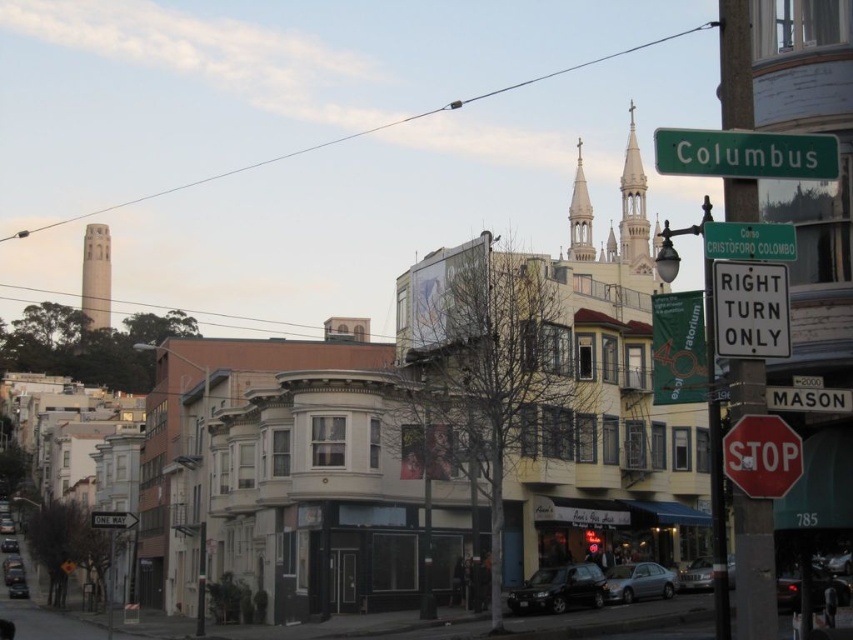
Question: Which point is farther to the camera?

Choices:
 (A) (691, 588)
 (B) (763, 476)
 (C) (811, 140)

Answer: (A)

Question: Which of the following is the closest to the observer?

Choices:
 (A) (123, 516)
 (B) (753, 454)
 (C) (581, 173)
 (D) (576, 573)

Answer: (B)

Question: Is the position of white plastic sign at center more distant than that of green plastic street sign at upper center?

Choices:
 (A) no
 (B) yes

Answer: (A)

Question: Which object appears farthest from the camera in this image?

Choices:
 (A) shiny black sedan at center
 (B) green metallic street sign at upper center

Answer: (A)

Question: Does satin silver sedan at lower center have a smaller size compared to white plastic stop sign at lower right?

Choices:
 (A) no
 (B) yes

Answer: (A)

Question: Does red matte stop sign at lower right lie behind satin silver sedan at lower center?

Choices:
 (A) no
 (B) yes

Answer: (A)